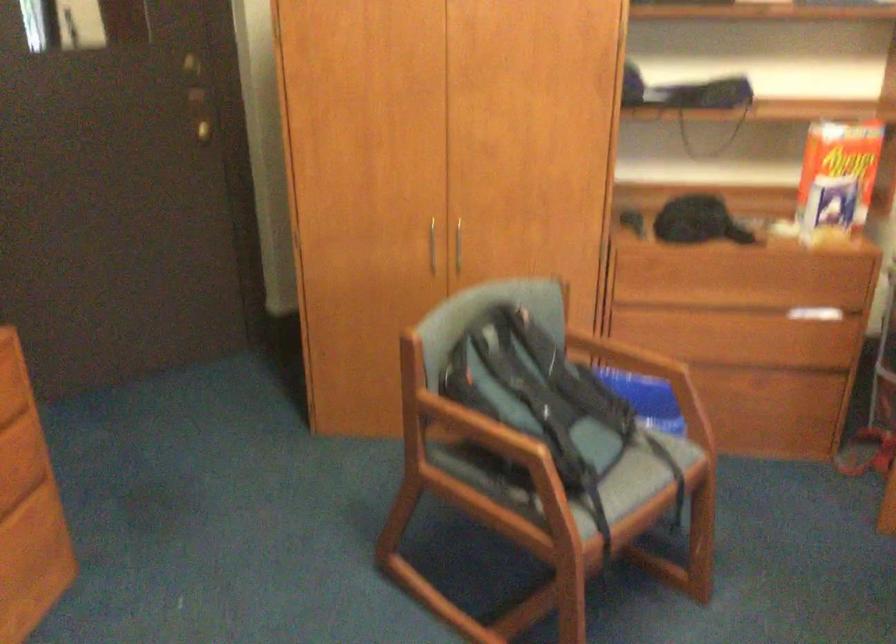
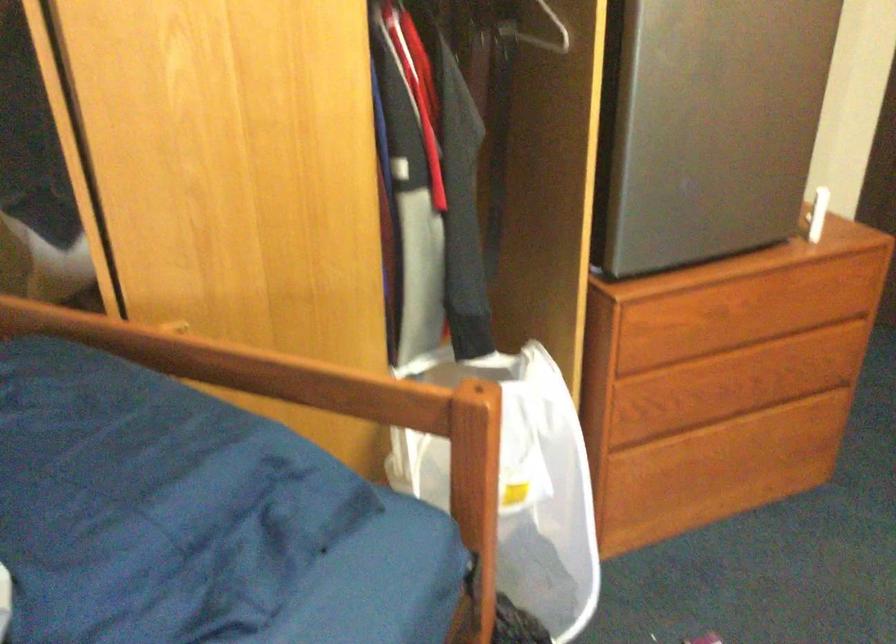
Question: The camera is either moving clockwise (left) or counter-clockwise (right) around the object. The first image is from the beginning of the video and the second image is from the end. Is the camera moving left or right when shooting the video?

Choices:
 (A) Left
 (B) Right

Answer: (B)